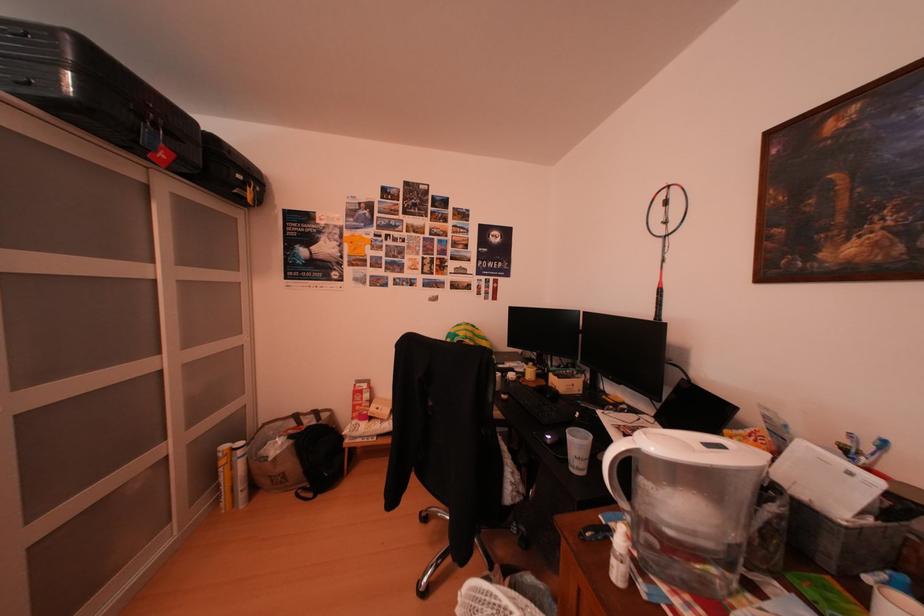
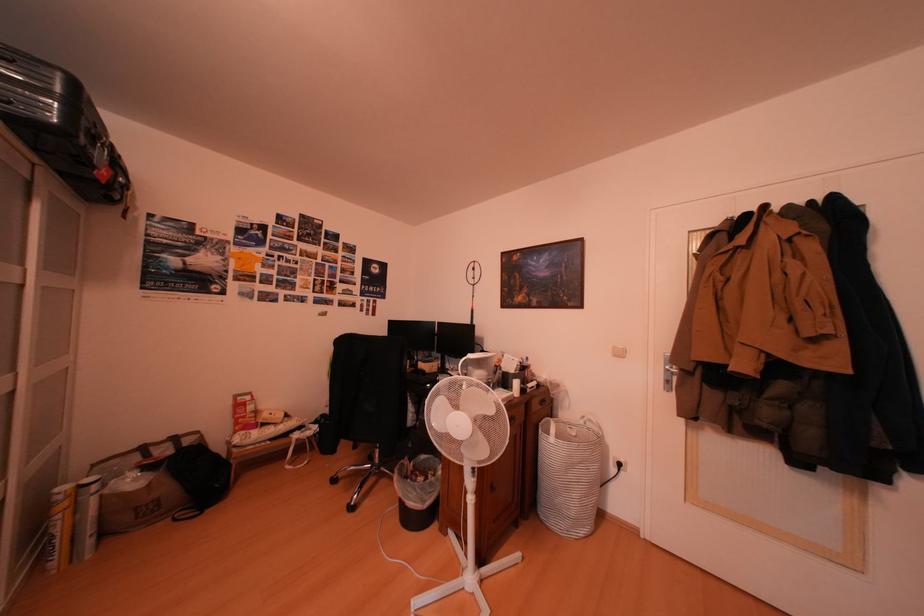
In the second image, find the point that corresponds to pixel 324 421 in the first image.

(180, 450)